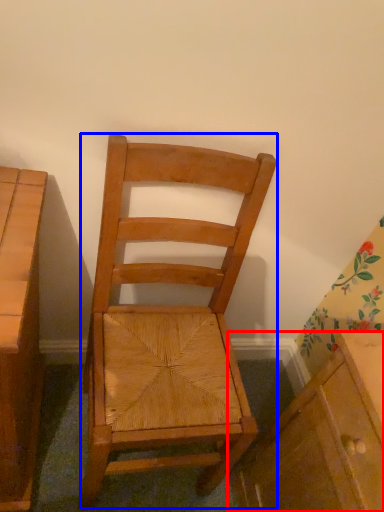
Question: Which of the following is the farthest to the observer, cabinetry (highlighted by a red box) or chair (highlighted by a blue box)?

Choices:
 (A) cabinetry
 (B) chair

Answer: (A)